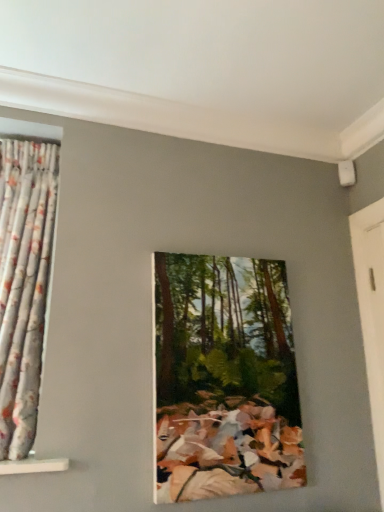
Question: From the image's perspective, would you say oil painting of forest at center is positioned over white wooden door at right?

Choices:
 (A) yes
 (B) no

Answer: (B)

Question: Is the surface of oil painting of forest at center in direct contact with white wooden door at right?

Choices:
 (A) no
 (B) yes

Answer: (A)

Question: From a real-world perspective, is oil painting of forest at center physically below white wooden door at right?

Choices:
 (A) yes
 (B) no

Answer: (A)

Question: Is oil painting of forest at center oriented away from white wooden door at right?

Choices:
 (A) no
 (B) yes

Answer: (A)

Question: Considering the relative sizes of oil painting of forest at center and white wooden door at right in the image provided, is oil painting of forest at center thinner than white wooden door at right?

Choices:
 (A) no
 (B) yes

Answer: (A)

Question: Based on their sizes in the image, would you say floral fabric curtain at left is bigger or smaller than white wooden door at right?

Choices:
 (A) small
 (B) big

Answer: (B)

Question: In the image, is floral fabric curtain at left positioned in front of or behind white wooden door at right?

Choices:
 (A) behind
 (B) front

Answer: (B)

Question: Is floral fabric curtain at left inside or outside of white wooden door at right?

Choices:
 (A) outside
 (B) inside

Answer: (A)

Question: Is point (21, 452) closer or farther from the camera than point (382, 414)?

Choices:
 (A) closer
 (B) farther

Answer: (A)

Question: In the image, is oil painting of forest at center positioned in front of or behind white wooden door at right?

Choices:
 (A) front
 (B) behind

Answer: (A)

Question: Would you say oil painting of forest at center is to the left or to the right of white wooden door at right in the picture?

Choices:
 (A) left
 (B) right

Answer: (A)

Question: In terms of width, does oil painting of forest at center look wider or thinner when compared to white wooden door at right?

Choices:
 (A) thin
 (B) wide

Answer: (B)

Question: Is oil painting of forest at center taller or shorter than white wooden door at right?

Choices:
 (A) short
 (B) tall

Answer: (A)

Question: From a real-world perspective, is white wooden door at right physically located above or below oil painting of forest at center?

Choices:
 (A) below
 (B) above

Answer: (B)

Question: In the image, is white wooden door at right positioned in front of or behind oil painting of forest at center?

Choices:
 (A) front
 (B) behind

Answer: (B)